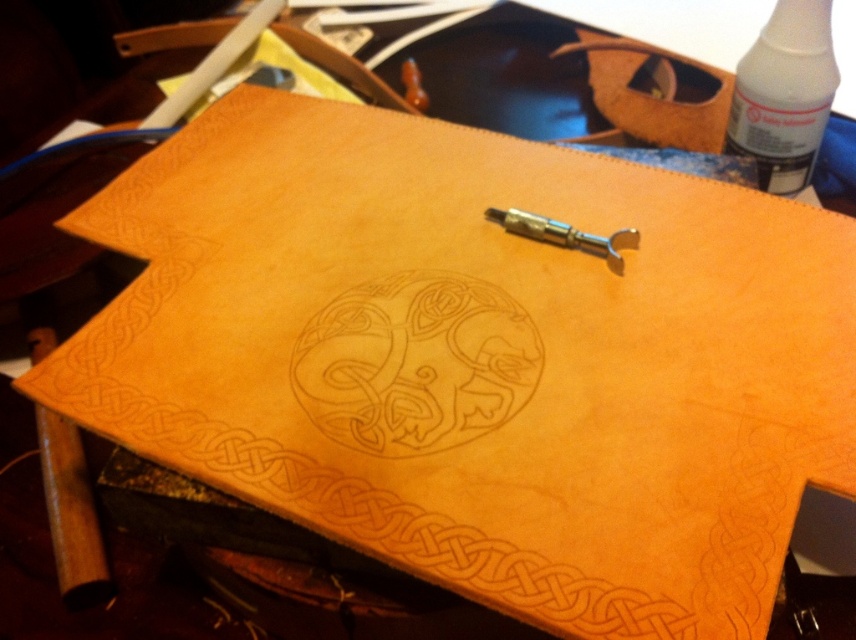
Looking at this image, you are an artisan working on a leather project. You need to place a new tool on the workbench. The light brown leather design at center and the white glossy bottle at upper right are already present. Which object is shorter so you can place the tool next to it?

The light brown leather design at center is shorter than the white glossy bottle at upper right, so you can place the tool next to the light brown leather design at center.

You are an artisan working on the leather piece and need to place both the white glossy bottle at upper right and the polished brass tool at center onto a small shelf that can only hold one object. Based on their sizes, which object should you choose to place on the shelf?

The white glossy bottle at upper right is larger in size than the polished brass tool at center. Therefore, you should choose the smaller object, the polished brass tool at center, to place on the small shelf since it can only hold one object.